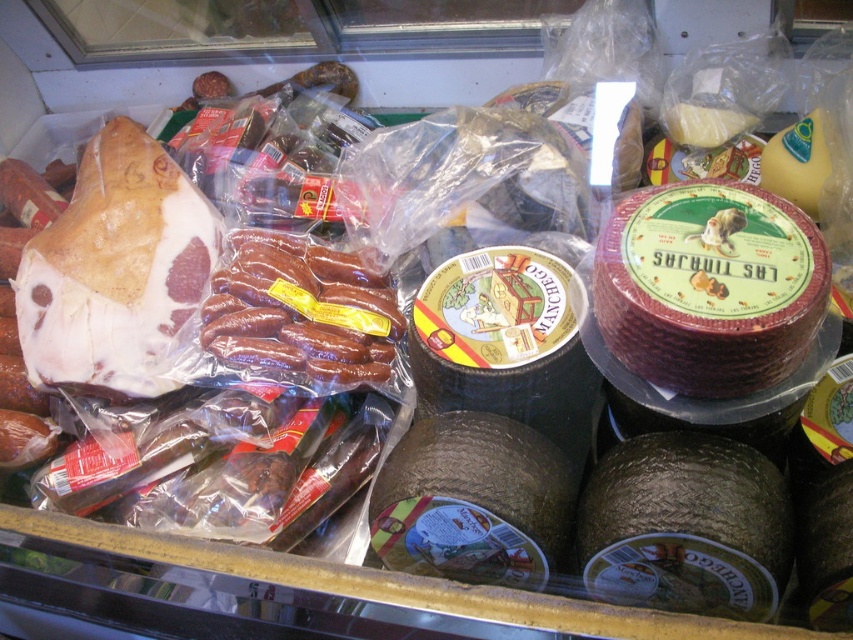
Question: Does red textured cheese at center right appear on the right side of brown glossy sausages at center?

Choices:
 (A) no
 (B) yes

Answer: (B)

Question: Which point appears farthest from the camera in this image?

Choices:
 (A) (729, 230)
 (B) (364, 314)

Answer: (B)

Question: Among these points, which one is farthest from the camera?

Choices:
 (A) (281, 282)
 (B) (607, 348)

Answer: (A)

Question: Does red textured cheese at center right appear on the left side of brown glossy sausages at center?

Choices:
 (A) yes
 (B) no

Answer: (B)

Question: Which point is closer to the camera?

Choices:
 (A) tap(656, 372)
 (B) tap(303, 344)

Answer: (A)

Question: Is red textured cheese at center right wider than brown glossy sausages at center?

Choices:
 (A) no
 (B) yes

Answer: (A)